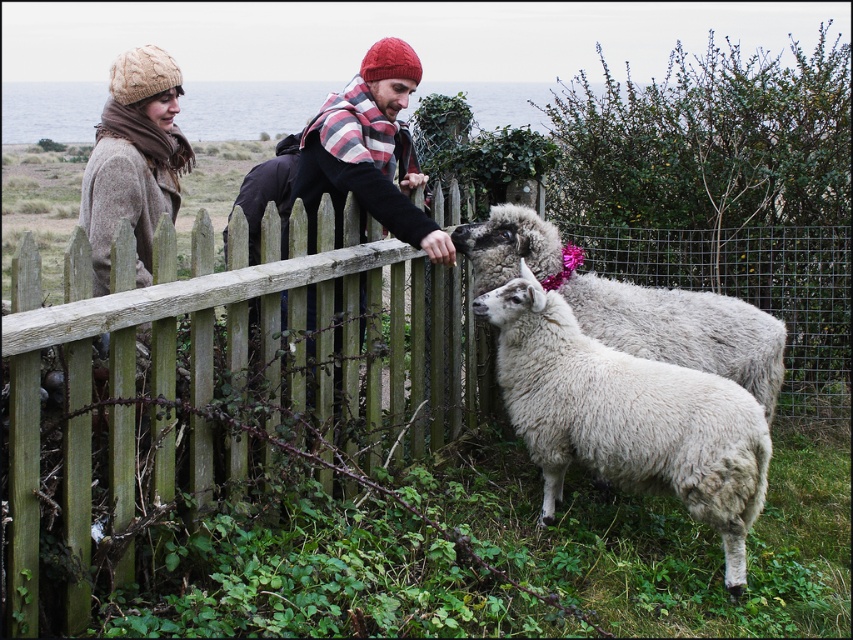
Is the position of wooden fence at center less distant than that of knitted beige hat at upper left?

Yes, it is.

Between wooden fence at center and knitted beige hat at upper left, which one appears on the right side from the viewer's perspective?

wooden fence at center is more to the right.

Is point (374, 541) in front of point (138, 102)?

That is True.

The width and height of the screenshot is (853, 640). I want to click on wooden fence at center, so (310, 452).

Is point (763, 499) positioned before point (169, 106)?

Yes, point (763, 499) is in front of point (169, 106).

Describe the element at coordinates (627, 417) in the screenshot. I see `white woolly sheep at center` at that location.

The width and height of the screenshot is (853, 640). Find the location of `white woolly sheep at center`. white woolly sheep at center is located at coordinates (627, 417).

Is wooden fence at center in front of white woolly sheep at center?

Yes, wooden fence at center is in front of white woolly sheep at center.

Is wooden fence at center above white woolly sheep at center?

Yes, wooden fence at center is above white woolly sheep at center.

Does point (283, 362) come in front of point (519, 292)?

Yes, it is.

Where is `wooden fence at center`? wooden fence at center is located at coordinates (310, 452).